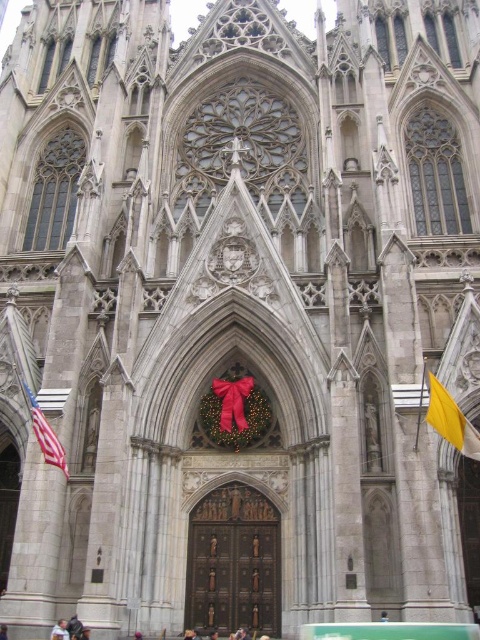
Describe the element at coordinates (451, 420) in the screenshot. I see `yellow fabric flag at right` at that location.

Which is behind, point (436, 381) or point (68, 634)?

The point (436, 381) is more distant.

Who is more distant from viewer, [432,378] or [52,634]?

Positioned behind is point [432,378].

Where is `yellow fabric flag at right`? This screenshot has width=480, height=640. yellow fabric flag at right is located at coordinates (451, 420).

Is red velvet wreath at center below yellow fabric flag at right?

Yes, red velvet wreath at center is below yellow fabric flag at right.

Between red velvet wreath at center and yellow fabric flag at right, which one has more height?

Standing taller between the two is red velvet wreath at center.

The height and width of the screenshot is (640, 480). What do you see at coordinates (235, 413) in the screenshot?
I see `red velvet wreath at center` at bounding box center [235, 413].

Where is `red velvet wreath at center`? red velvet wreath at center is located at coordinates (235, 413).

Is the position of american flag at left less distant than that of light blue shirt at center?

That is False.

In the scene shown: Does american flag at left have a lesser width compared to light blue shirt at center?

Incorrect, american flag at left's width is not less than light blue shirt at center's.

Where is `american flag at left`? Image resolution: width=480 pixels, height=640 pixels. american flag at left is located at coordinates (45, 433).

Image resolution: width=480 pixels, height=640 pixels. Find the location of `american flag at left`. american flag at left is located at coordinates (45, 433).